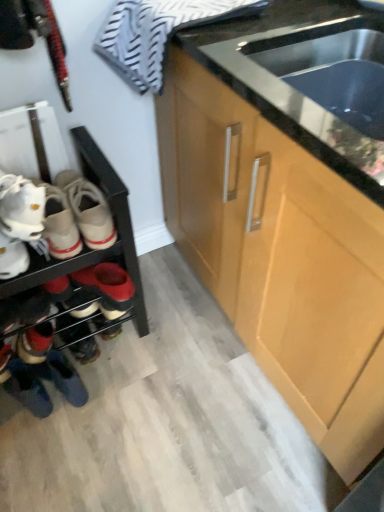
In order to face striped cotton towel at upper left, should I rotate leftwards or rightwards?

You should rotate left by 0.298 degrees.

The width and height of the screenshot is (384, 512). I want to click on matte wood cabinet at center, so click(x=280, y=256).

Describe the element at coordinates (280, 256) in the screenshot. This screenshot has height=512, width=384. I see `matte wood cabinet at center` at that location.

This screenshot has height=512, width=384. What do you see at coordinates (35, 329) in the screenshot?
I see `leather sneakers at lower left, which is the 2th footwear from front to back` at bounding box center [35, 329].

Identify the location of white matte shoes at left, placed as the first footwear when sorted from top to bottom. (19, 223).

Is striped cotton towel at upper left situated inside white matte shoes at left, placed as the first footwear when sorted from top to bottom, or outside?

striped cotton towel at upper left is outside white matte shoes at left, placed as the first footwear when sorted from top to bottom.

Between striped cotton towel at upper left and white matte shoes at left, placed as the first footwear when sorted from top to bottom, which one has more height?

Standing taller between the two is striped cotton towel at upper left.

From the image's perspective, between striped cotton towel at upper left and white matte shoes at left, placed as the first footwear when sorted from top to bottom, who is located below?

white matte shoes at left, placed as the first footwear when sorted from top to bottom, from the image's perspective.

Is striped cotton towel at upper left looking in the opposite direction of white matte shoes at left, positioned as the 1th footwear in front-to-back order?

No, white matte shoes at left, positioned as the 1th footwear in front-to-back order, is not at the back of striped cotton towel at upper left.

Consider the image. Is there a large distance between leather sneakers at lower left, the first footwear positioned from the bottom, and matte wood cabinet at center?

No, leather sneakers at lower left, the first footwear positioned from the bottom, is in close proximity to matte wood cabinet at center.

Based on the photo, is leather sneakers at lower left, marked as the 2th footwear in a top-to-bottom arrangement, shorter than matte wood cabinet at center?

→ Indeed, leather sneakers at lower left, marked as the 2th footwear in a top-to-bottom arrangement, has a lesser height compared to matte wood cabinet at center.

Identify the location of cabinetry that appears above the leather sneakers at lower left, marked as the 2th footwear in a top-to-bottom arrangement (from a real-world perspective). This screenshot has height=512, width=384. (280, 256).

Consider the image. From a real-world perspective, who is located higher, leather sneakers at lower left, the first footwear positioned from the bottom, or matte wood cabinet at center?

matte wood cabinet at center.

Considering the sizes of objects black matte shoe rack at left and leather sneakers at lower left, the first footwear positioned from the bottom, in the image provided, who is wider, black matte shoe rack at left or leather sneakers at lower left, the first footwear positioned from the bottom,?

black matte shoe rack at left.

You are a GUI agent. You are given a task and a screenshot of the screen. Output one action in this format:
    pyautogui.click(x=<x>, y=<y>)
    Task: Click on the footwear lying below the black matte shoe rack at left (from the image's perspective)
    The height and width of the screenshot is (512, 384).
    Given the screenshot: What is the action you would take?
    pyautogui.click(x=35, y=329)

Considering their positions, is black matte shoe rack at left located in front of or behind leather sneakers at lower left, the first footwear positioned from the bottom?

black matte shoe rack at left is positioned closer to the viewer than leather sneakers at lower left, the first footwear positioned from the bottom.

Is black matte shoe rack at left aimed at leather sneakers at lower left, the 1th footwear in the back-to-front sequence?

Yes.

In terms of size, does black matte shoe rack at left appear bigger or smaller than striped cotton towel at upper left?

Considering their sizes, black matte shoe rack at left takes up more space than striped cotton towel at upper left.

Consider the image. From the image's perspective, which object appears higher, black matte shoe rack at left or striped cotton towel at upper left?

From the image's view, striped cotton towel at upper left is above.

Is black matte shoe rack at left positioned far away from striped cotton towel at upper left?

black matte shoe rack at left is near striped cotton towel at upper left, not far away.

Which is more distant, [359,25] or [46,311]?

The point [46,311] is farther from the camera.

Looking at this image, is stainless steel sink at center positioned beyond the bounds of leather sneakers at lower left, which is the 2th footwear from front to back?

That's correct, stainless steel sink at center is outside of leather sneakers at lower left, which is the 2th footwear from front to back.

How far apart are stainless steel sink at center and leather sneakers at lower left, marked as the 2th footwear in a top-to-bottom arrangement?

The distance of stainless steel sink at center from leather sneakers at lower left, marked as the 2th footwear in a top-to-bottom arrangement, is 33.54 inches.

Does stainless steel sink at center turn towards leather sneakers at lower left, the 1th footwear in the back-to-front sequence?

No, stainless steel sink at center is not oriented towards leather sneakers at lower left, the 1th footwear in the back-to-front sequence.

Based on the photo, could leather sneakers at lower left, which is the 2th footwear from front to back, be considered to be inside white matte shoes at left, positioned as the 1th footwear in front-to-back order?

No, leather sneakers at lower left, which is the 2th footwear from front to back, is not inside white matte shoes at left, positioned as the 1th footwear in front-to-back order.

Considering the relative positions of white matte shoes at left, placed as the first footwear when sorted from top to bottom, and leather sneakers at lower left, the first footwear positioned from the bottom, in the image provided, is white matte shoes at left, placed as the first footwear when sorted from top to bottom, to the left of leather sneakers at lower left, the first footwear positioned from the bottom, from the viewer's perspective?

Correct, you'll find white matte shoes at left, placed as the first footwear when sorted from top to bottom, to the left of leather sneakers at lower left, the first footwear positioned from the bottom.

In the scene shown: Which is behind, white matte shoes at left, the second footwear ordered from the bottom, or leather sneakers at lower left, marked as the 2th footwear in a top-to-bottom arrangement?

leather sneakers at lower left, marked as the 2th footwear in a top-to-bottom arrangement, is behind.

Are white matte shoes at left, positioned as the 1th footwear in front-to-back order, and leather sneakers at lower left, marked as the 2th footwear in a top-to-bottom arrangement, located far from each other?

They are positioned close to each other.

Consider the image. How different are the orientations of stainless steel sink at center and matte wood cabinet at center in degrees?

The angular difference between stainless steel sink at center and matte wood cabinet at center is 0.42 degrees.

Is the depth of stainless steel sink at center greater than that of matte wood cabinet at center?

That is True.

From a real-world perspective, is stainless steel sink at center positioned under matte wood cabinet at center based on gravity?

No, from a real-world perspective, stainless steel sink at center is not under matte wood cabinet at center.

Is stainless steel sink at center with matte wood cabinet at center?

stainless steel sink at center and matte wood cabinet at center are clearly separated.

At what (x,y) coordinates should I click in order to perform the action: click on laundry above the white matte shoes at left, the second footwear ordered from the bottom (from a real-world perspective). Please return your answer as a coordinate pair (x, y). Image resolution: width=384 pixels, height=512 pixels. Looking at the image, I should click on pos(157,33).

From the image's perspective, count 2nd footwears downward from the matte wood cabinet at center and point to it. Please provide its 2D coordinates.

[(35, 329)]

When comparing their distances from black matte shoe rack at left, does striped cotton towel at upper left or matte wood cabinet at center seem further?

Among the two, matte wood cabinet at center is located further to black matte shoe rack at left.

Which object lies nearer to the anchor point white matte shoes at left, the second footwear ordered from the bottom, stainless steel sink at center or striped cotton towel at upper left?

striped cotton towel at upper left lies closer to white matte shoes at left, the second footwear ordered from the bottom, than the other object.

Which object lies further to the anchor point striped cotton towel at upper left, matte wood cabinet at center or black matte shoe rack at left?

matte wood cabinet at center is further to striped cotton towel at upper left.

Based on their spatial positions, is leather sneakers at lower left, the 1th footwear in the back-to-front sequence, or black matte shoe rack at left closer to stainless steel sink at center?

The object closer to stainless steel sink at center is black matte shoe rack at left.

Looking at the image, which one is located closer to black matte shoe rack at left, stainless steel sink at center or white matte shoes at left, positioned as the 1th footwear in front-to-back order?

Among the two, white matte shoes at left, positioned as the 1th footwear in front-to-back order, is located nearer to black matte shoe rack at left.

Which object lies nearer to the anchor point black matte shoe rack at left, leather sneakers at lower left, marked as the 2th footwear in a top-to-bottom arrangement, or white matte shoes at left, which is the 2th footwear from back to front?

The object closer to black matte shoe rack at left is white matte shoes at left, which is the 2th footwear from back to front.

Based on their spatial positions, is black matte shoe rack at left or leather sneakers at lower left, marked as the 2th footwear in a top-to-bottom arrangement, further from matte wood cabinet at center?

Among the two, leather sneakers at lower left, marked as the 2th footwear in a top-to-bottom arrangement, is located further to matte wood cabinet at center.

Looking at the image, which one is located closer to white matte shoes at left, positioned as the 1th footwear in front-to-back order, black matte shoe rack at left or stainless steel sink at center?

Based on the image, black matte shoe rack at left appears to be nearer to white matte shoes at left, positioned as the 1th footwear in front-to-back order.

What are the coordinates of `countertop that lies between striped cotton towel at upper left and matte wood cabinet at center from top to bottom` in the screenshot? It's located at (297, 71).

In order to click on countertop situated between white matte shoes at left, which is the 2th footwear from back to front, and matte wood cabinet at center from left to right in this screenshot , I will do `click(297, 71)`.

You are a GUI agent. You are given a task and a screenshot of the screen. Output one action in this format:
    pyautogui.click(x=<x>, y=<y>)
    Task: Click on the laundry between white matte shoes at left, the second footwear ordered from the bottom, and stainless steel sink at center
    This screenshot has height=512, width=384.
    Given the screenshot: What is the action you would take?
    pyautogui.click(x=157, y=33)

Locate an element on the screen. Image resolution: width=384 pixels, height=512 pixels. shelf located between leather sneakers at lower left, the 1th footwear in the back-to-front sequence, and matte wood cabinet at center in the left-right direction is located at coordinates (84, 245).